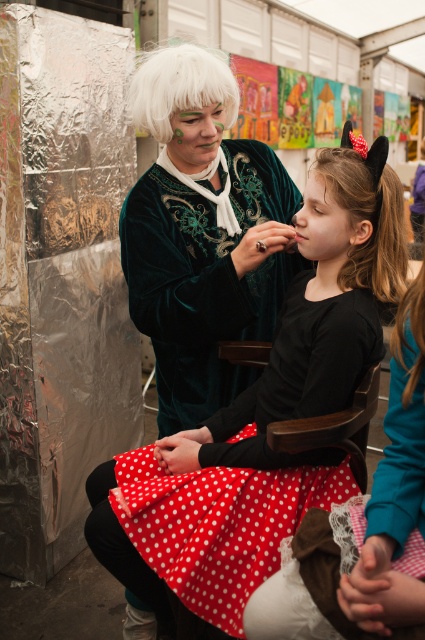
You are a photographer setting up for a photoshoot and notice the velvet green dress at center and the brown silky hair at center in the frame. Based on their sizes, which object would you need to adjust your camera focus on first if you want to capture both clearly?

The velvet green dress at center is larger in size than the brown silky hair at center, so you should focus on the velvet green dress at center first to ensure it is in clear view before adjusting for the smaller brown silky hair at center.

What is the color of the fabric at point (317, 316) in the image?

The point (317, 316) is on the polka dot fabric dress at center, which has a vibrant red skirt with white polka dots. The color at that point would depend on whether it is on the red background or a white polka dot. Since the description specifies it is on the polka dot fabric dress, the color could be either red or white.

You are a photographer trying to capture a clear shot of the velvet green dress at center and the white fluffy wig at upper center. Which object should you focus on first to ensure it appears sharp in the photo?

The velvet green dress at center is closer to the viewer than the white fluffy wig at upper center, so you should focus on the velvet green dress at center first to ensure it appears sharp.